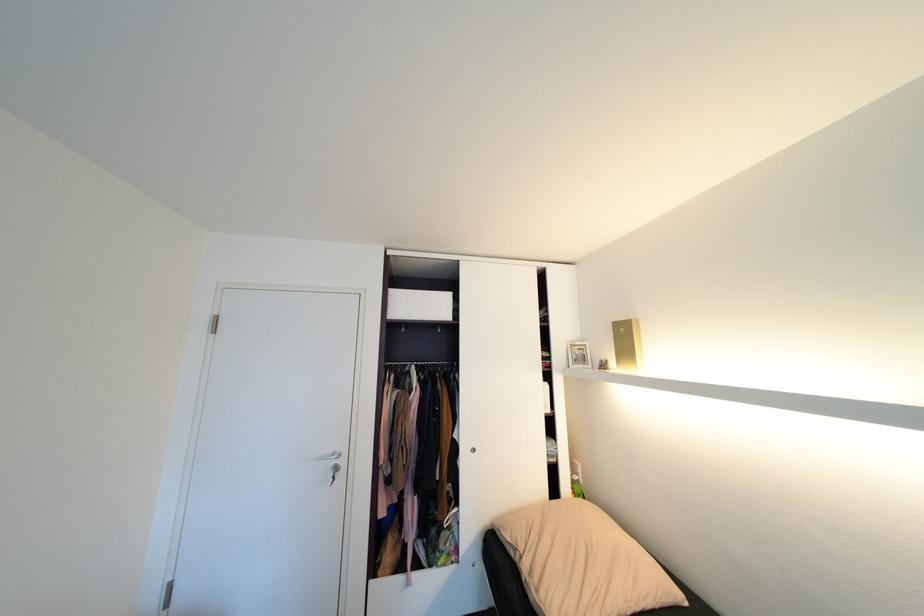
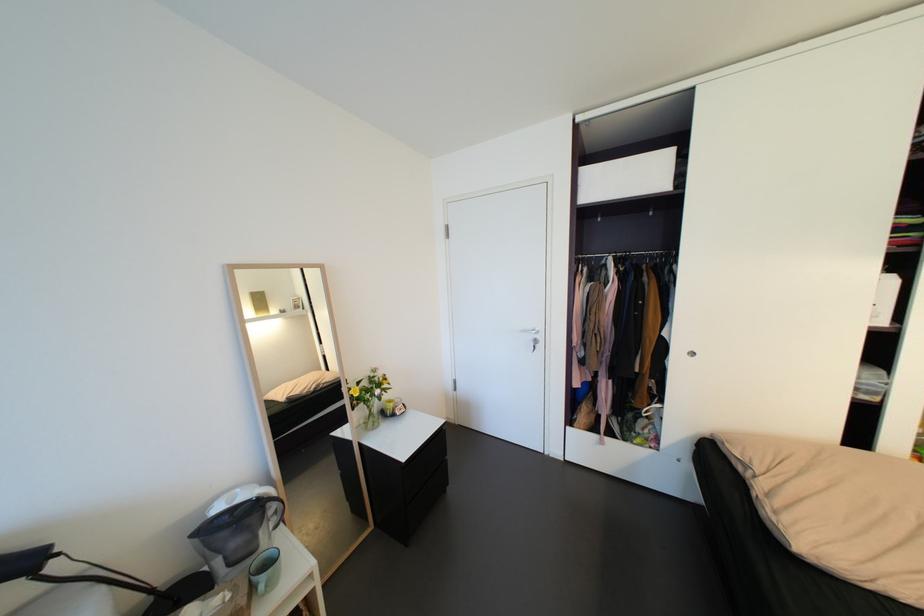
Find the pixel in the second image that matches (x=553, y=386) in the first image.

(900, 278)